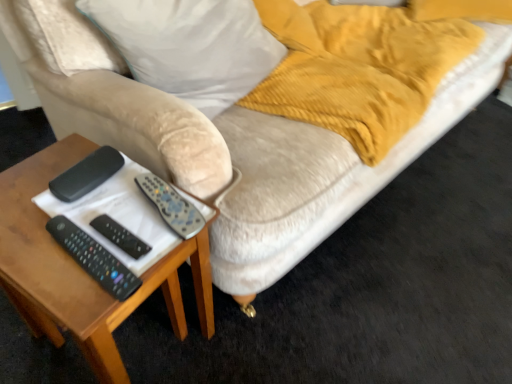
Identify the location of free space between black plastic remote at center, arranged as the 2th remote when ordered from the bottom, and black plastic remote control at left. (115, 210).